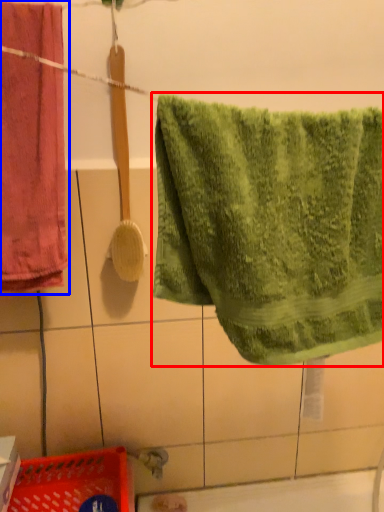
Question: Which of the following is the closest to the observer, towel (highlighted by a red box) or towel (highlighted by a blue box)?

Choices:
 (A) towel
 (B) towel

Answer: (A)